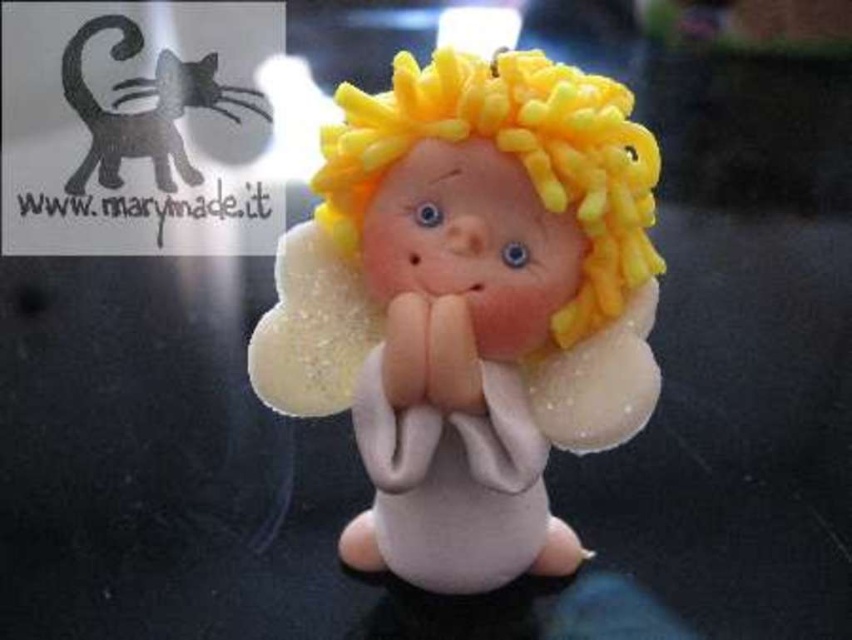
Question: Which object appears closest to the camera in this image?

Choices:
 (A) yellow fluffy hair at center
 (B) matte white angel at center

Answer: (A)

Question: Is matte white angel at center thinner than yellow fluffy hair at center?

Choices:
 (A) yes
 (B) no

Answer: (B)

Question: Which object is farther from the camera taking this photo?

Choices:
 (A) yellow fluffy hair at center
 (B) matte white angel at center
 (C) matte black cat at upper left

Answer: (C)

Question: Which object appears farthest from the camera in this image?

Choices:
 (A) matte white angel at center
 (B) matte black cat at upper left

Answer: (B)

Question: Can you confirm if matte white angel at center is positioned above yellow fluffy hair at center?

Choices:
 (A) no
 (B) yes

Answer: (A)

Question: Can you confirm if matte white angel at center is bigger than matte black cat at upper left?

Choices:
 (A) no
 (B) yes

Answer: (B)